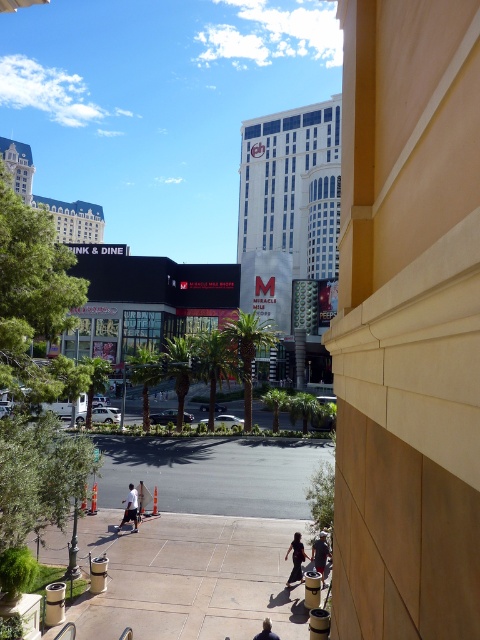
Question: Estimate the real-world distances between objects in this image. Which object is closer to the dark blue jeans at lower center?

Choices:
 (A) blonde hair at lower center
 (B) denim pants at lower right

Answer: (B)

Question: Considering the real-world distances, which object is closest to the beige stone building at center?

Choices:
 (A) gold metallic hotel at upper left
 (B) white cotton shirt at center

Answer: (B)

Question: Is white glass building at center thinner than blonde hair at lower center?

Choices:
 (A) no
 (B) yes

Answer: (A)

Question: Based on their relative distances, which object is nearer to the beige stone building at center?

Choices:
 (A) blonde hair at lower center
 (B) white glass building at center

Answer: (A)

Question: Considering the relative positions of gold metallic hotel at upper left and denim pants at lower right in the image provided, where is gold metallic hotel at upper left located with respect to denim pants at lower right?

Choices:
 (A) left
 (B) right

Answer: (A)

Question: Is beige stone building at center thinner than gold metallic hotel at upper left?

Choices:
 (A) yes
 (B) no

Answer: (A)